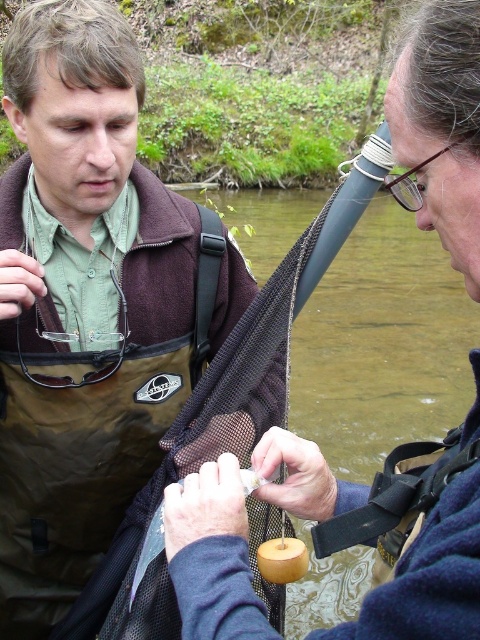
Question: Does matte black vest at center appear under matte black vest at left?

Choices:
 (A) no
 (B) yes

Answer: (A)

Question: Among these points, which one is nearest to the camera?

Choices:
 (A) (419, 156)
 (B) (207, 250)

Answer: (A)

Question: Can you confirm if matte black vest at center is positioned to the left of matte black vest at left?

Choices:
 (A) no
 (B) yes

Answer: (B)

Question: From the image, what is the correct spatial relationship of matte black vest at center in relation to matte black vest at left?

Choices:
 (A) left
 (B) right

Answer: (A)

Question: Among these points, which one is nearest to the camera?

Choices:
 (A) (170, 556)
 (B) (14, 230)

Answer: (A)